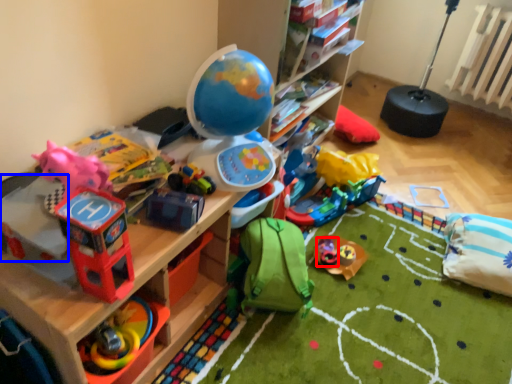
Question: Which object appears farthest to the camera in this image, toy (highlighted by a red box) or toy (highlighted by a blue box)?

Choices:
 (A) toy
 (B) toy

Answer: (A)